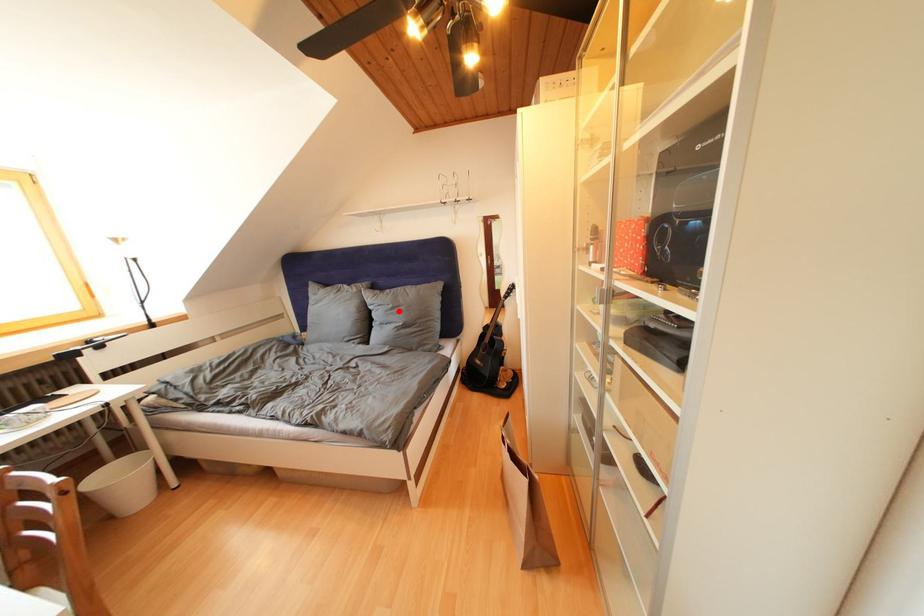
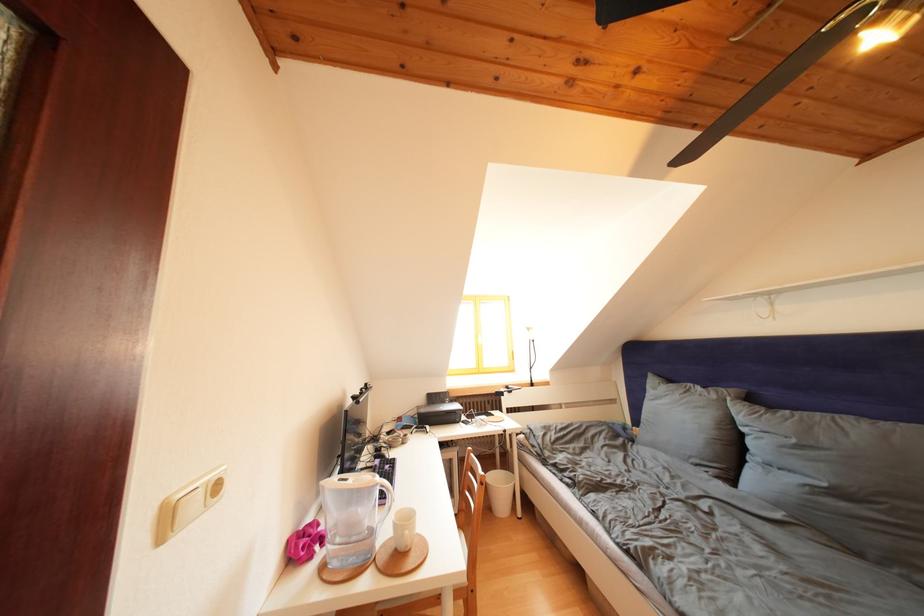
Question: I am providing you with two images of the same scene from different viewpoints. Given a red point in image1, look at the same physical point in image2. Is it:

Choices:
 (A) Closer to the viewpoint
 (B) Farther from the viewpoint

Answer: (B)